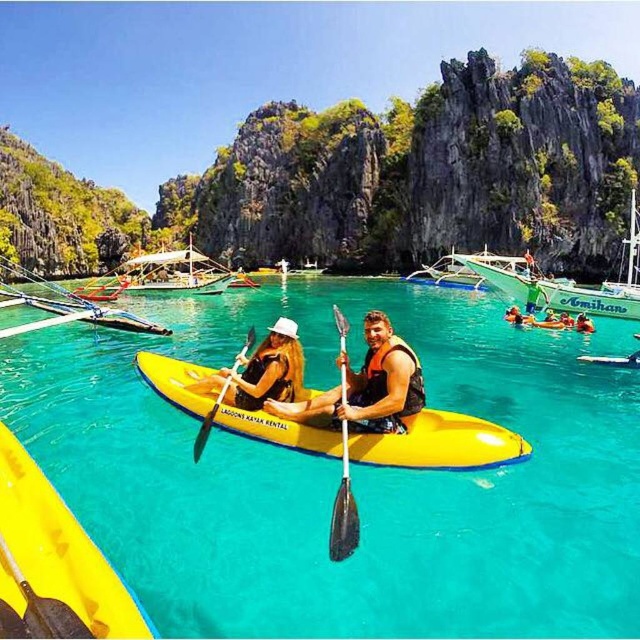
Question: Is matte yellow kayak at center above white wooden boat at center?

Choices:
 (A) yes
 (B) no

Answer: (B)

Question: Based on their relative distances, which object is farther from the white plastic paddle at center?

Choices:
 (A) matte black kayak at center
 (B) green plastic boat at upper right
 (C) yellow life vest at center
 (D) white wooden boat at center

Answer: (C)

Question: Which point is farther from the camera taking this photo?

Choices:
 (A) (465, 276)
 (B) (618, 310)
 (C) (150, 273)
 (D) (198, 385)

Answer: (C)

Question: Is transparent yellow kayak at center bigger than matte black kayak at center?

Choices:
 (A) yes
 (B) no

Answer: (A)

Question: Considering the real-world distances, which object is closest to the green plastic boat at upper right?

Choices:
 (A) yellow matte kayak at center
 (B) white plastic paddle at center
 (C) wooden boat at center

Answer: (A)

Question: Can you confirm if green plastic boat at upper right is positioned above black plastic paddle at center?

Choices:
 (A) no
 (B) yes

Answer: (B)